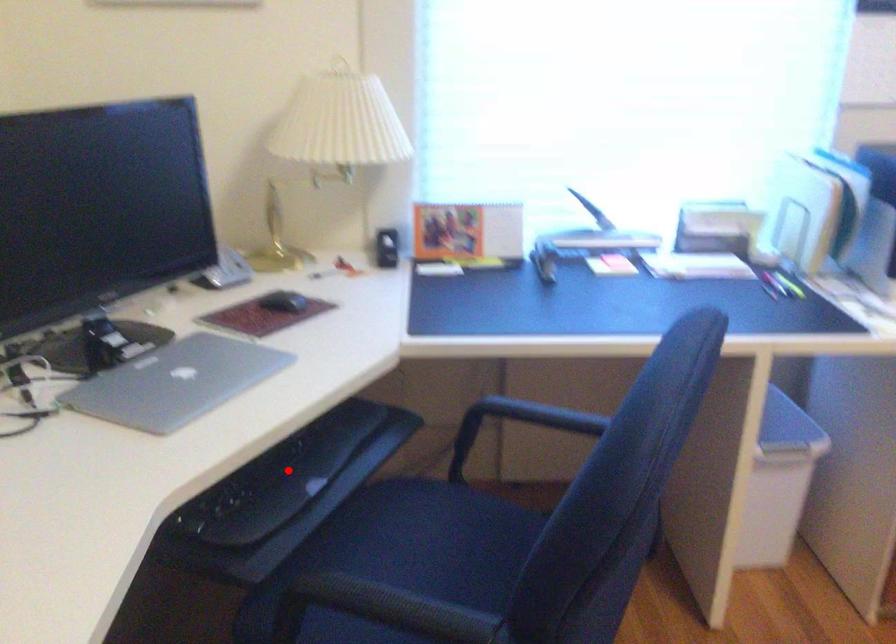
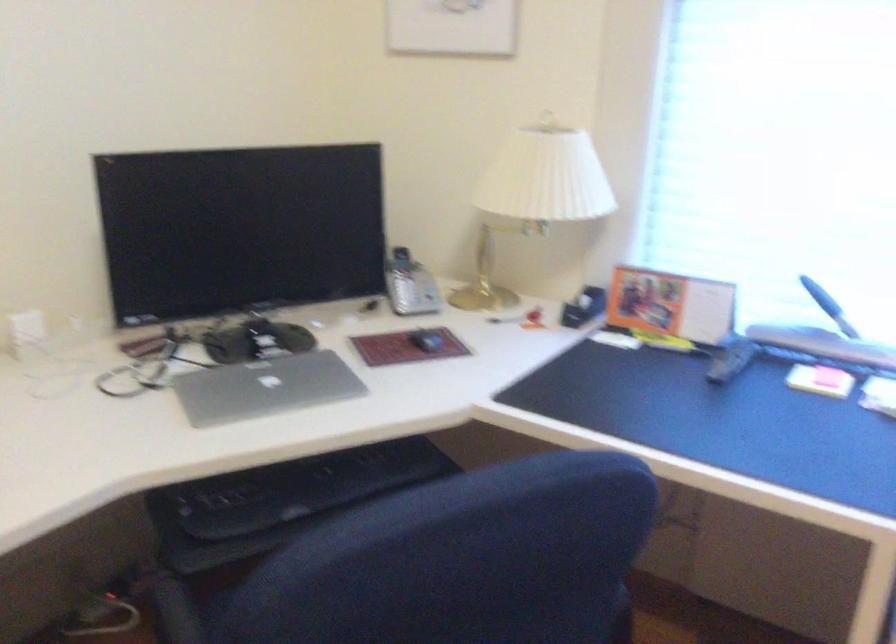
The point at the highlighted location is marked in the first image. Where is the corresponding point in the second image?

(302, 488)